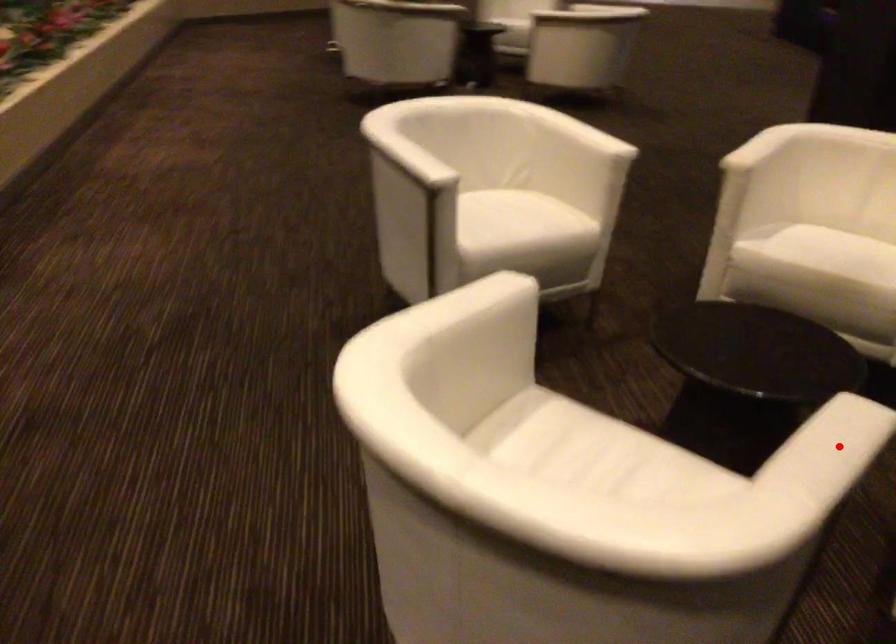
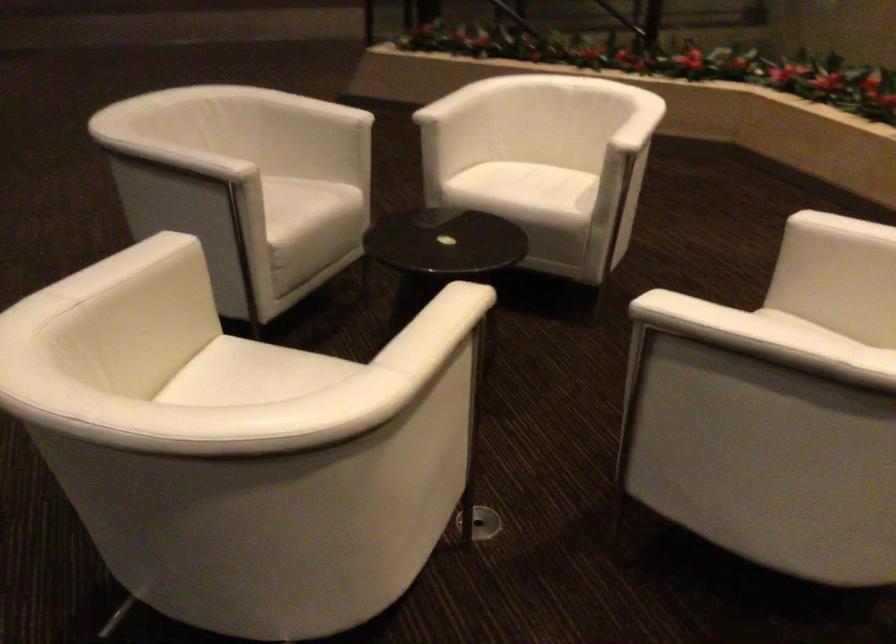
Question: I am providing you with two images of the same scene from different viewpoints. A red point is marked on the first image. Can you still see the location of the red point in image 2?

Choices:
 (A) Yes
 (B) No

Answer: (B)